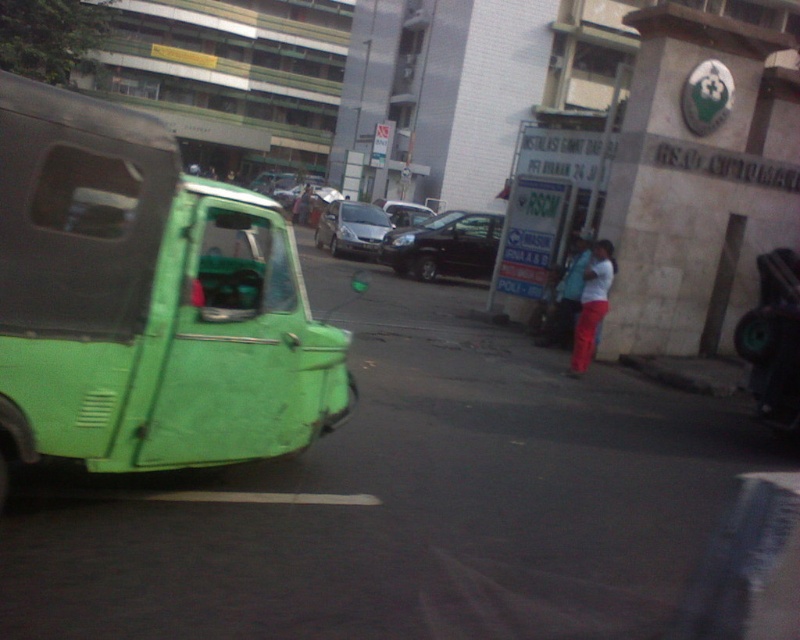
You are a pedestrian standing on the sidewalk. You see the satin silver car at center and the white matte shirt at center. Which object is closer to you?

The satin silver car at center is closer to you because the white matte shirt at center is behind it.

Consider the image. You are a delivery driver who needs to park your vehicle between the shiny black car at center and the satin silver car at center. Given that your van is wider than both cars, can you safely park your van in this space without overlapping either vehicle?

The shiny black car at center is narrower than the satin silver car at center. Since your van is wider than both, the space between them may not be sufficient. Check the total width of the available space before deciding.

You are standing on the sidewalk in the urban street scene. There is a point at coordinates point (329,246) that you want to reach. If you can walk 1.5 meters per second, how many seconds will it take you to reach that point?

The distance of point (329,246) from viewer is 26.57 meters. At a walking speed of 1.5 meters per second, it would take approximately 17.71 seconds to reach the point.